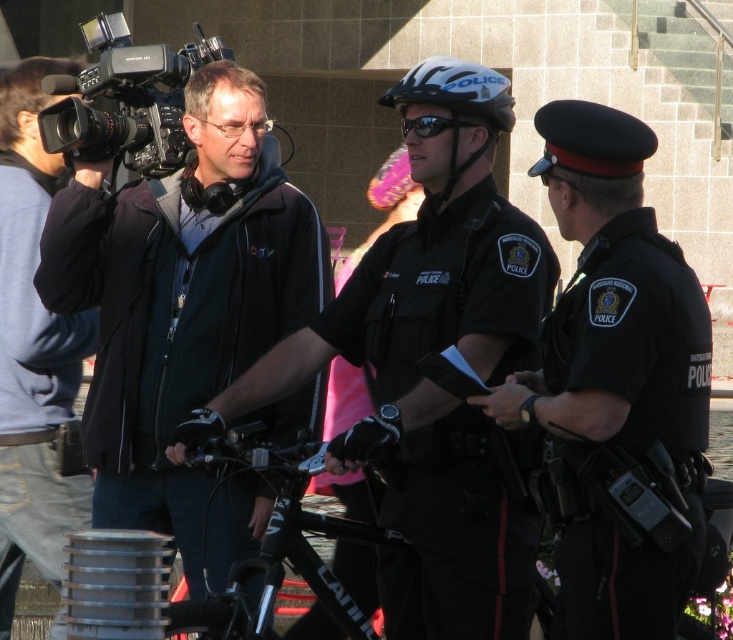
Question: From the image, what is the correct spatial relationship of matte black camera at left in relation to black plastic video camera at upper left?

Choices:
 (A) below
 (B) above

Answer: (A)

Question: Observing the image, what is the correct spatial positioning of matte black jacket at center in reference to dark blue uniform at center?

Choices:
 (A) below
 (B) above

Answer: (A)

Question: Which point appears closest to the camera in this image?

Choices:
 (A) (456, 145)
 (B) (248, 289)
 (C) (574, 113)

Answer: (C)

Question: Which point is farther to the camera?

Choices:
 (A) (479, 278)
 (B) (106, 403)

Answer: (B)

Question: Among these points, which one is nearest to the camera?

Choices:
 (A) (84, 145)
 (B) (268, 289)

Answer: (A)

Question: Observing the image, what is the correct spatial positioning of matte black jacket at center in reference to dark blue uniform at center?

Choices:
 (A) right
 (B) left

Answer: (B)